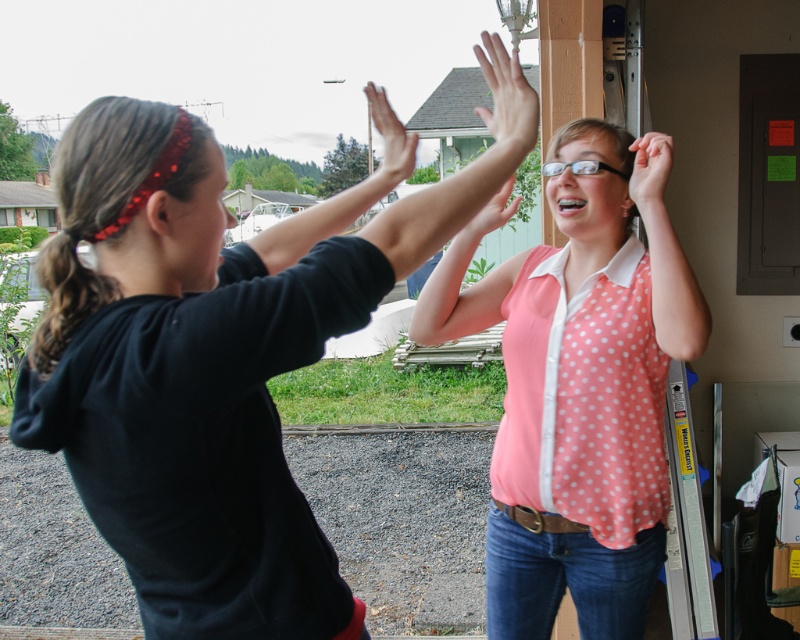
Does black matte arm at upper center have a lesser height compared to pink polka dot shirt at upper center?

Yes, black matte arm at upper center is shorter than pink polka dot shirt at upper center.

Which is in front, point (281, 220) or point (492, 218)?

Point (281, 220)

This screenshot has width=800, height=640. I want to click on black matte arm at upper center, so click(341, 193).

Does matte pink shirt at upper right lie in front of pink polka dot shirt at upper center?

No, matte pink shirt at upper right is behind pink polka dot shirt at upper center.

Measure the distance between point (658, 209) and camera.

5.45 feet

What do you see at coordinates (650, 176) in the screenshot?
I see `matte pink shirt at upper right` at bounding box center [650, 176].

What are the coordinates of `matte pink shirt at upper right` in the screenshot? It's located at (650, 176).

Which of these two, matte black hand at upper center or matte pink shirt at upper right, stands taller?

With more height is matte black hand at upper center.

Between point (502, 58) and point (666, 172), which one is positioned in front?

Point (502, 58) is more forward.

Does point (488, 125) come closer to viewer compared to point (636, 188)?

Yes, point (488, 125) is in front of point (636, 188).

What are the coordinates of `matte black hand at upper center` in the screenshot? It's located at (506, 102).